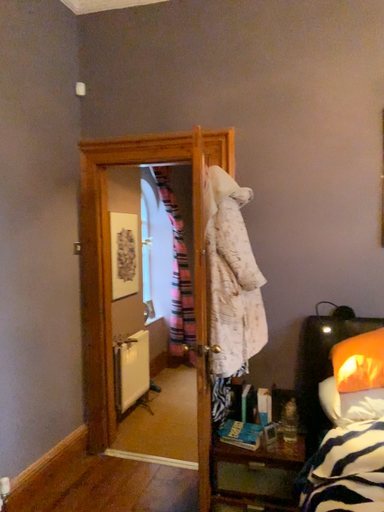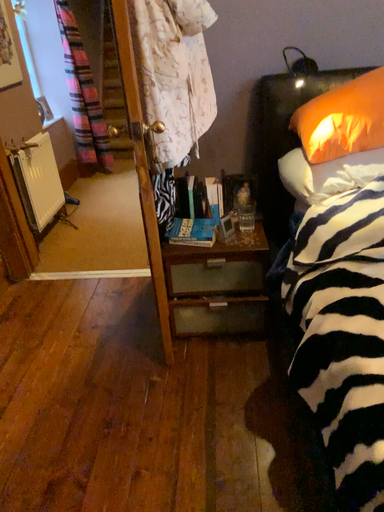
Question: How did the camera likely rotate when shooting the video?

Choices:
 (A) rotated left
 (B) rotated right

Answer: (B)